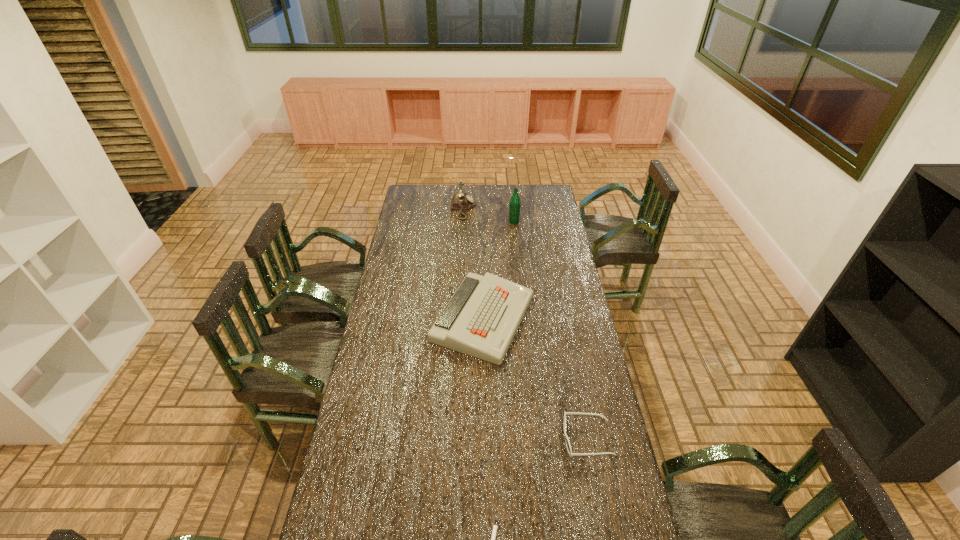
In order to click on the tallest object in this screenshot , I will do `click(515, 203)`.

What are the coordinates of `telephone` in the screenshot? It's located at (460, 201).

Find the location of a particular element. computer keyboard is located at coordinates (481, 319).

Find the location of `the third shortest object`. the third shortest object is located at coordinates (481, 319).

Identify the location of the rightmost object. (568, 446).

I want to click on the second nearest object, so click(x=568, y=446).

Where is `free space located 0.350m on the left of the tallest object`? The image size is (960, 540). free space located 0.350m on the left of the tallest object is located at coordinates click(446, 221).

Identify the location of free spot located on the dial of the fourth shortest object. Image resolution: width=960 pixels, height=540 pixels. (502, 208).

Where is `vacant space situated 0.210m on the back of the third farthest object`? The height and width of the screenshot is (540, 960). vacant space situated 0.210m on the back of the third farthest object is located at coordinates (483, 253).

Find the location of a particular element. free point located 0.060m with the lenses of the fourth tallest object facing outward is located at coordinates (545, 438).